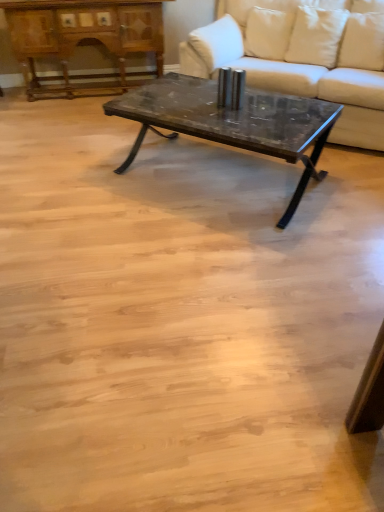
Find the location of `vacant space underneath dark gray stone coffee table at center (from a real-world perspective)`. vacant space underneath dark gray stone coffee table at center (from a real-world perspective) is located at coordinates (234, 186).